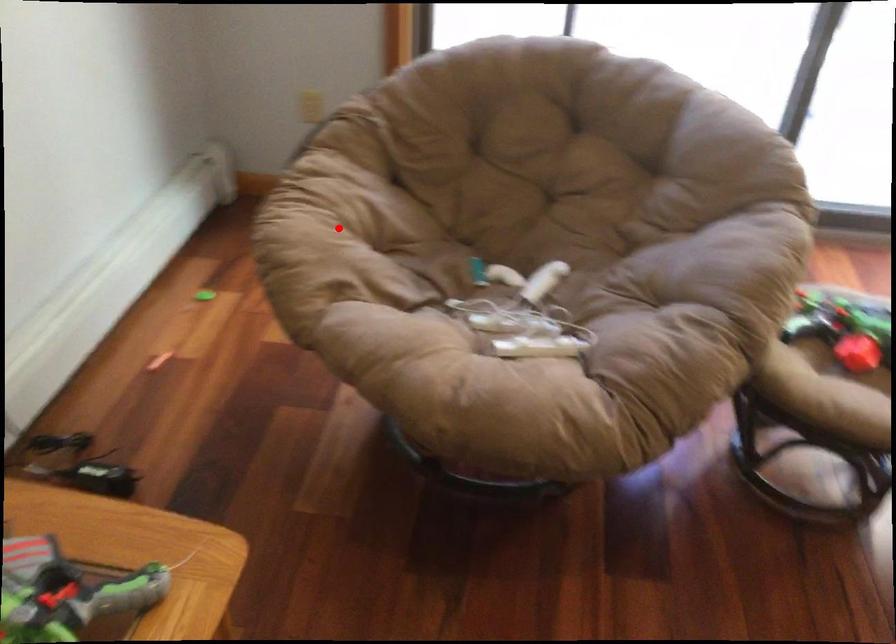
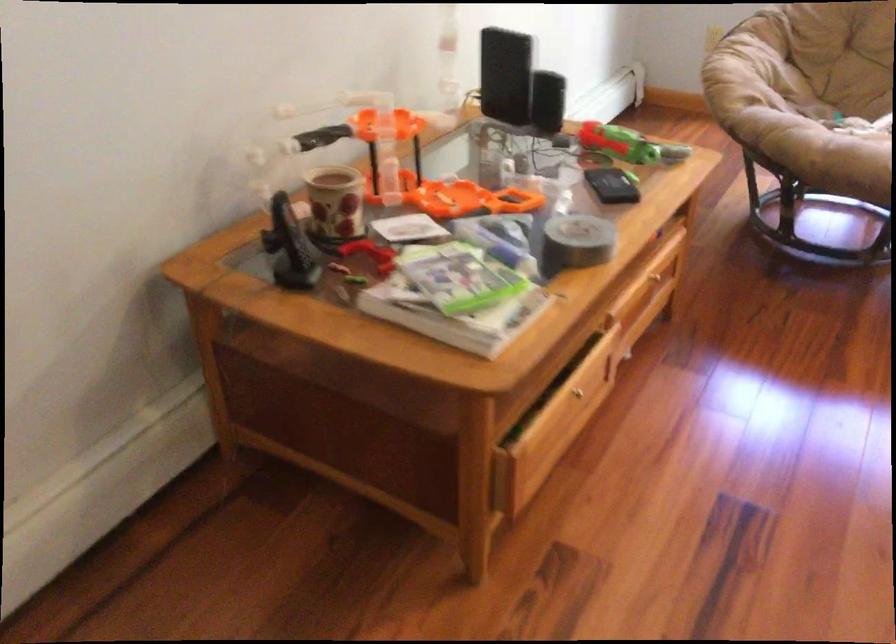
The point at the highlighted location is marked in the first image. Where is the corresponding point in the second image?

(745, 69)